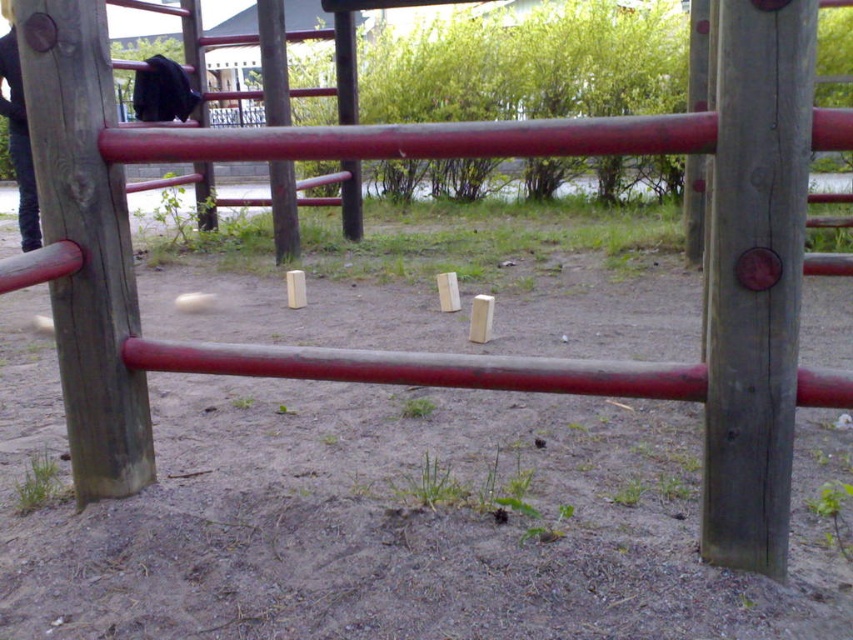
You are a child trying to find the smooth wood pole at center. Which direction should you look relative to the brushed wood pole at center?

The smooth wood pole at center is located to the right of the brushed wood pole at center.

You are a child trying to reach the smooth wood pole at center and the wooden pole at left. Which pole is closer to you?

The smooth wood pole at center is closer because it is in front of the wooden pole at left.

Based on the photo, you are a maintenance worker inspecting the playground structure. You notice two poles at the center. Which one is closer to you, the wooden pole at center or the brushed wood pole at center?

The wooden pole at center is closer to you because it is in front of the brushed wood pole at center.